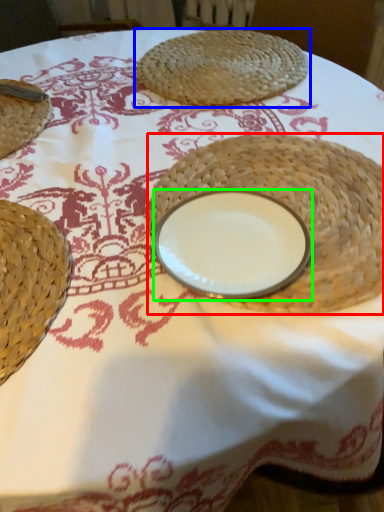
Question: Considering the real-world distances, which object is farthest from straw hat (highlighted by a red box)? food (highlighted by a blue box) or tableware (highlighted by a green box)?

Choices:
 (A) food
 (B) tableware

Answer: (A)